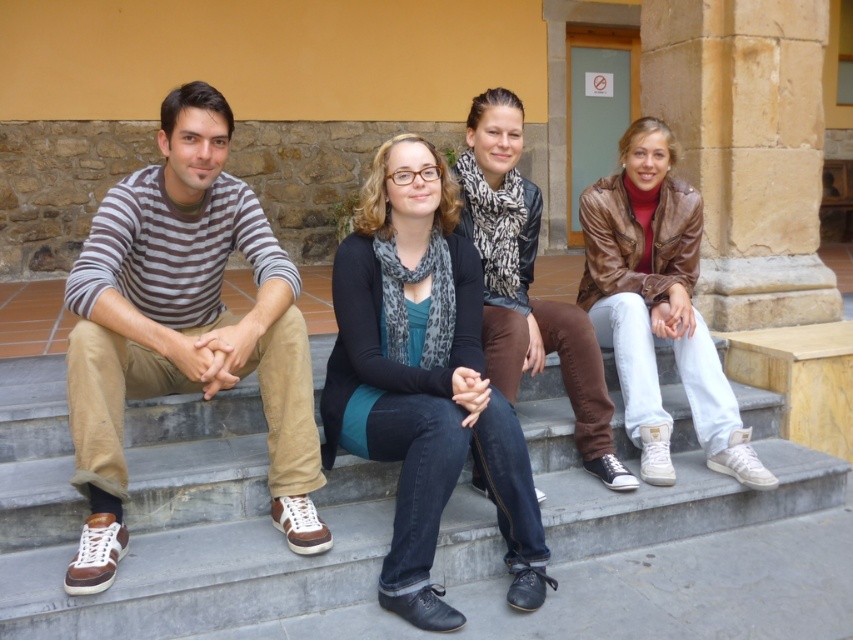
Based on the photo, you are standing in front of the group on the steps. Which item is positioned more to the left side between the brown suede shoes at left and the brown leather jacket at lower right?

The brown suede shoes at left are positioned more to the left side than the brown leather jacket at lower right.